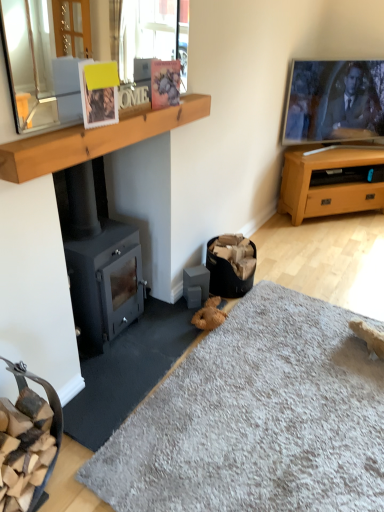
Question: Can you confirm if soft gray carpet at lower center is shorter than matte plastic picture frame at upper center, the 2th picture frame when ordered from front to back?

Choices:
 (A) yes
 (B) no

Answer: (A)

Question: Can you confirm if soft gray carpet at lower center is positioned to the right of matte plastic picture frame at upper center, which is the first picture frame from right to left?

Choices:
 (A) no
 (B) yes

Answer: (B)

Question: Does soft gray carpet at lower center lie in front of matte plastic picture frame at upper center, which is the first picture frame from right to left?

Choices:
 (A) no
 (B) yes

Answer: (B)

Question: Can we say soft gray carpet at lower center lies outside matte plastic picture frame at upper center, the 2th picture frame when ordered from front to back?

Choices:
 (A) no
 (B) yes

Answer: (B)

Question: Considering the relative sizes of soft gray carpet at lower center and matte plastic picture frame at upper center, which is the first picture frame from right to left, in the image provided, is soft gray carpet at lower center taller than matte plastic picture frame at upper center, which is the first picture frame from right to left,?

Choices:
 (A) yes
 (B) no

Answer: (B)

Question: In terms of height, does clear glass mirror at upper left look taller or shorter compared to wooden at upper center?

Choices:
 (A) tall
 (B) short

Answer: (A)

Question: Does point pyautogui.click(x=168, y=45) appear closer or farther from the camera than point pyautogui.click(x=180, y=117)?

Choices:
 (A) closer
 (B) farther

Answer: (A)

Question: Is clear glass mirror at upper left in front of or behind wooden at upper center in the image?

Choices:
 (A) behind
 (B) front

Answer: (B)

Question: Looking at their shapes, would you say clear glass mirror at upper left is wider or thinner than wooden at upper center?

Choices:
 (A) wide
 (B) thin

Answer: (B)

Question: From the image's perspective, relative to soft gray carpet at lower center, is light brown wood tv stand at right above or below?

Choices:
 (A) below
 (B) above

Answer: (B)

Question: Considering the relative positions of light brown wood tv stand at right and soft gray carpet at lower center in the image provided, is light brown wood tv stand at right to the left or to the right of soft gray carpet at lower center?

Choices:
 (A) left
 (B) right

Answer: (B)

Question: Considering their positions, is light brown wood tv stand at right located in front of or behind soft gray carpet at lower center?

Choices:
 (A) front
 (B) behind

Answer: (B)

Question: Looking at their shapes, would you say light brown wood tv stand at right is wider or thinner than soft gray carpet at lower center?

Choices:
 (A) thin
 (B) wide

Answer: (A)

Question: Relative to white matte picture frame at upper center, which is the first picture frame in left-to-right order, is soft gray carpet at lower center in front or behind?

Choices:
 (A) front
 (B) behind

Answer: (A)

Question: From the image's perspective, is soft gray carpet at lower center above or below white matte picture frame at upper center, which appears as the 1th picture frame when viewed from the front?

Choices:
 (A) above
 (B) below

Answer: (B)